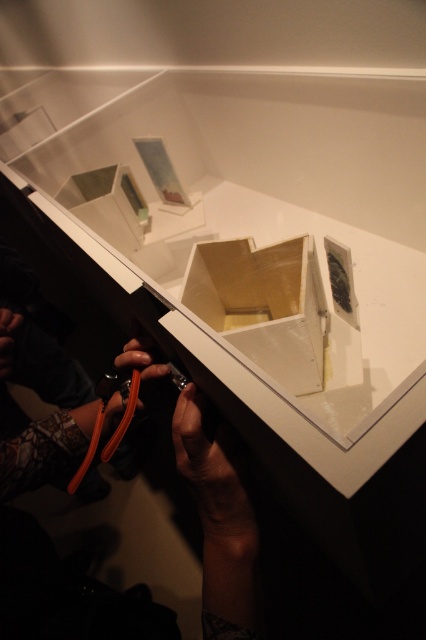
Between orange rubber hose at lower left and white glossy box at center, which one has less height?

Standing shorter between the two is white glossy box at center.

Which is behind, point (224, 552) or point (261, 289)?

The point (261, 289) is behind.

Between point (184, 410) and point (210, 272), which one is positioned behind?

The point (210, 272) is behind.

Locate an element on the screen. orange rubber hose at lower left is located at coordinates (218, 525).

Does orange rubber hose at lower left have a greater height compared to matte plastic box at upper left?

Yes, orange rubber hose at lower left is taller than matte plastic box at upper left.

Which is above, orange rubber hose at lower left or matte plastic box at upper left?

matte plastic box at upper left is higher up.

At what (x,y) coordinates should I click in order to perform the action: click on orange rubber hose at lower left. Please return your answer as a coordinate pair (x, y). The image size is (426, 640). Looking at the image, I should click on (218, 525).

Find the location of `orange rubber hose at lower left`. orange rubber hose at lower left is located at coordinates (218, 525).

Which is above, white glossy box at center or matte plastic box at upper left?

matte plastic box at upper left is above.

Which is behind, point (314, 339) or point (120, 228)?

The point (120, 228) is behind.

You are a GUI agent. You are given a task and a screenshot of the screen. Output one action in this format:
    pyautogui.click(x=<x>, y=<y>)
    Task: Click on the white glossy box at center
    
    Given the screenshot: What is the action you would take?
    pyautogui.click(x=261, y=305)